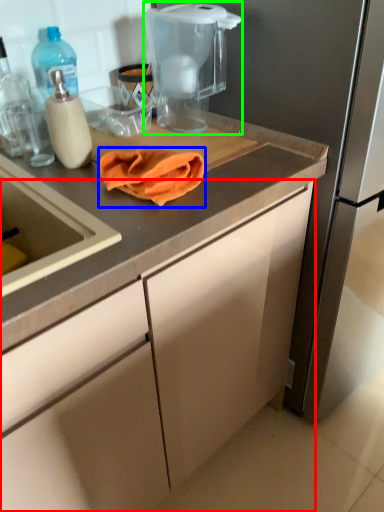
Question: Which is nearer to the cabinetry (highlighted by a red box)? blanket (highlighted by a blue box) or home appliance (highlighted by a green box).

Choices:
 (A) blanket
 (B) home appliance

Answer: (A)